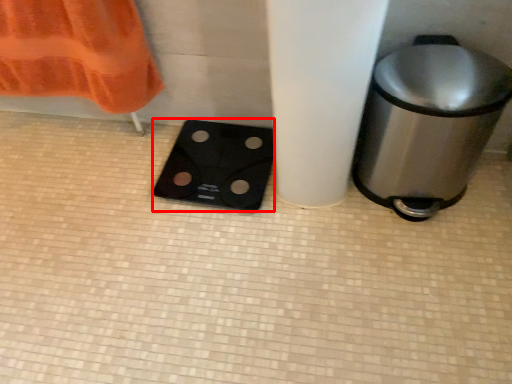
Question: In this image, where is appliance (annotated by the red box) located relative to waste container?

Choices:
 (A) right
 (B) left

Answer: (B)